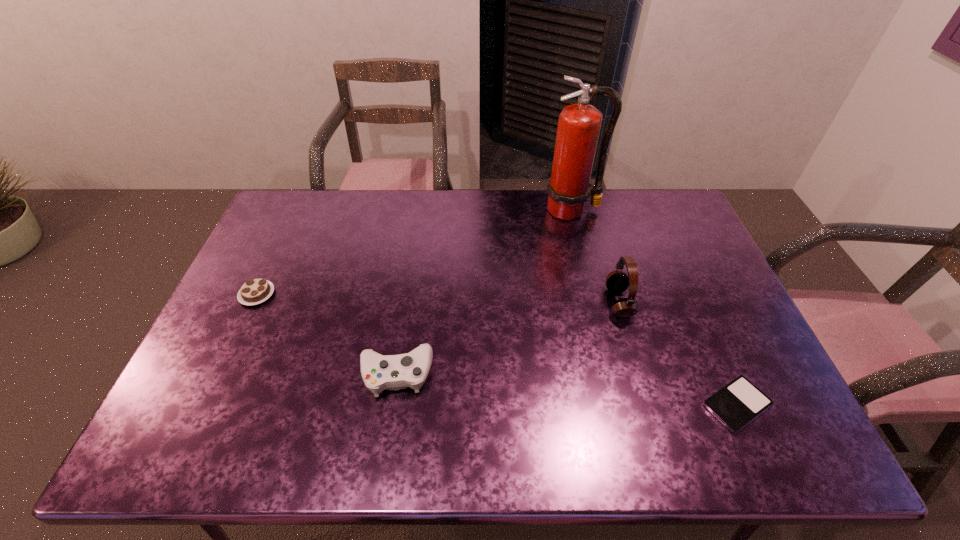
Where is `object present at the near right corner`? This screenshot has height=540, width=960. object present at the near right corner is located at coordinates (739, 402).

Find the location of a particular element. This screenshot has height=540, width=960. free space at the far edge of the desktop is located at coordinates (446, 211).

The image size is (960, 540). Identify the location of vacant space at the near edge. (254, 455).

At what (x,y) coordinates should I click in order to perform the action: click on free space at the left edge of the desktop. Please return your answer as a coordinate pair (x, y). The image size is (960, 540). Looking at the image, I should click on (203, 395).

The height and width of the screenshot is (540, 960). In the image, there is a desktop. What are the coordinates of `vacant space at the far left corner` in the screenshot? It's located at (324, 198).

In the image, there is a desktop. At what (x,y) coordinates should I click in order to perform the action: click on vacant space at the near left corner. Please return your answer as a coordinate pair (x, y). This screenshot has width=960, height=540. Looking at the image, I should click on (180, 443).

This screenshot has width=960, height=540. I want to click on free region at the far right corner of the desktop, so click(x=638, y=197).

Where is `free space at the near right corner`? free space at the near right corner is located at coordinates (772, 450).

Locate an element on the screen. This screenshot has height=540, width=960. unoccupied area between the farthest object and the control is located at coordinates (484, 292).

Identify the location of empty location between the control and the fourth shortest object. The width and height of the screenshot is (960, 540). (508, 338).